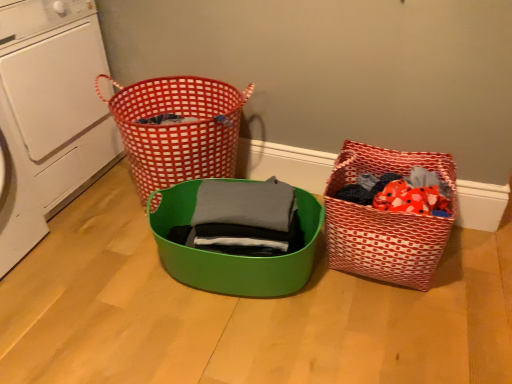
Question: Is the surface of white plastic washing machine at left in direct contact with red checkered basket at upper left?

Choices:
 (A) yes
 (B) no

Answer: (B)

Question: Does white plastic washing machine at left have a smaller size compared to red checkered basket at upper left?

Choices:
 (A) no
 (B) yes

Answer: (A)

Question: Is white plastic washing machine at left facing towards red checkered basket at upper left?

Choices:
 (A) no
 (B) yes

Answer: (B)

Question: Can you confirm if white plastic washing machine at left is shorter than red checkered basket at upper left?

Choices:
 (A) yes
 (B) no

Answer: (B)

Question: From a real-world perspective, is white plastic washing machine at left over red checkered basket at upper left?

Choices:
 (A) no
 (B) yes

Answer: (B)

Question: Can you confirm if white plastic washing machine at left is thinner than red checkered basket at upper left?

Choices:
 (A) yes
 (B) no

Answer: (B)

Question: Is matte green bowl at center, placed as the first basket when sorted from left to right, at the back of red woven fabric basket at lower right, which appears as the first basket when viewed from the right?

Choices:
 (A) yes
 (B) no

Answer: (B)

Question: Is matte green bowl at center, which ranks as the second basket in right-to-left order, completely or partially inside red woven fabric basket at lower right, which is the second basket from left to right?

Choices:
 (A) yes
 (B) no

Answer: (B)

Question: Does red woven fabric basket at lower right, which appears as the first basket when viewed from the right, appear on the left side of matte green bowl at center, placed as the first basket when sorted from left to right?

Choices:
 (A) no
 (B) yes

Answer: (A)

Question: Is red woven fabric basket at lower right, which appears as the first basket when viewed from the right, positioned beyond the bounds of matte green bowl at center, placed as the first basket when sorted from left to right?

Choices:
 (A) yes
 (B) no

Answer: (A)

Question: Is the depth of red woven fabric basket at lower right, which is the second basket from left to right, greater than that of matte green bowl at center, which ranks as the second basket in right-to-left order?

Choices:
 (A) yes
 (B) no

Answer: (A)

Question: From the image's perspective, is red woven fabric basket at lower right, which appears as the first basket when viewed from the right, under matte green bowl at center, which ranks as the second basket in right-to-left order?

Choices:
 (A) yes
 (B) no

Answer: (B)

Question: Does red checkered basket at upper left have a greater height compared to matte green bowl at center, which ranks as the second basket in right-to-left order?

Choices:
 (A) no
 (B) yes

Answer: (B)